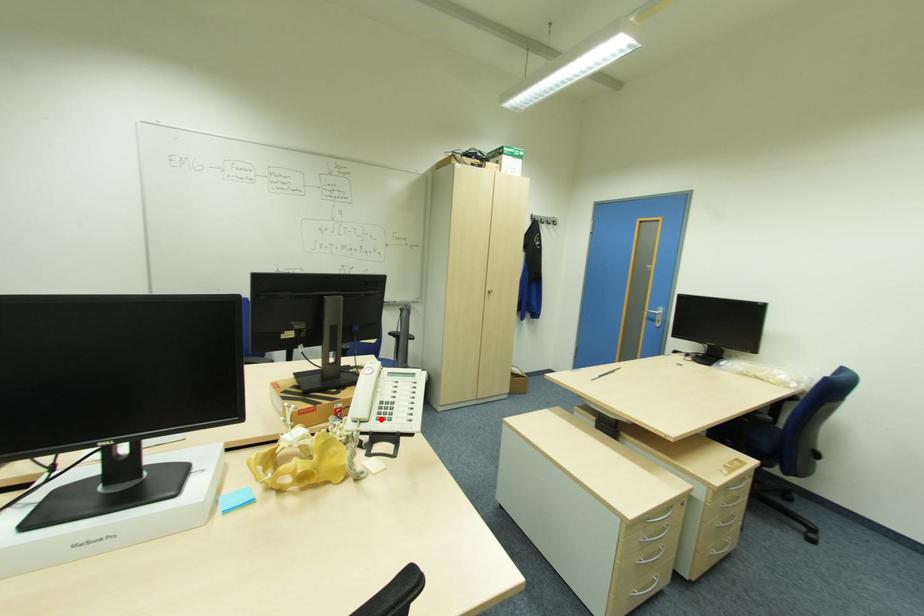
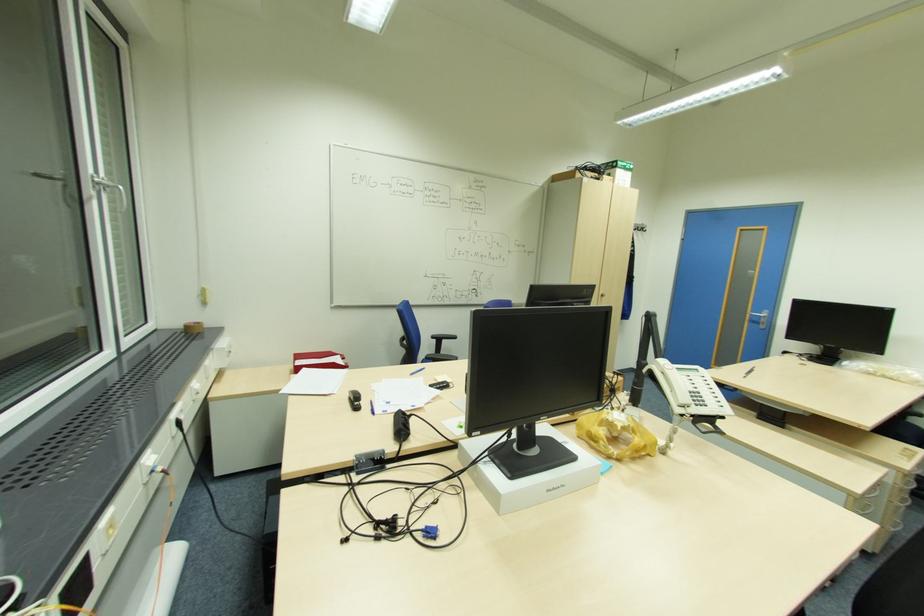
In the second image, find the point that corresponds to the highlighted location in the first image.

(699, 403)